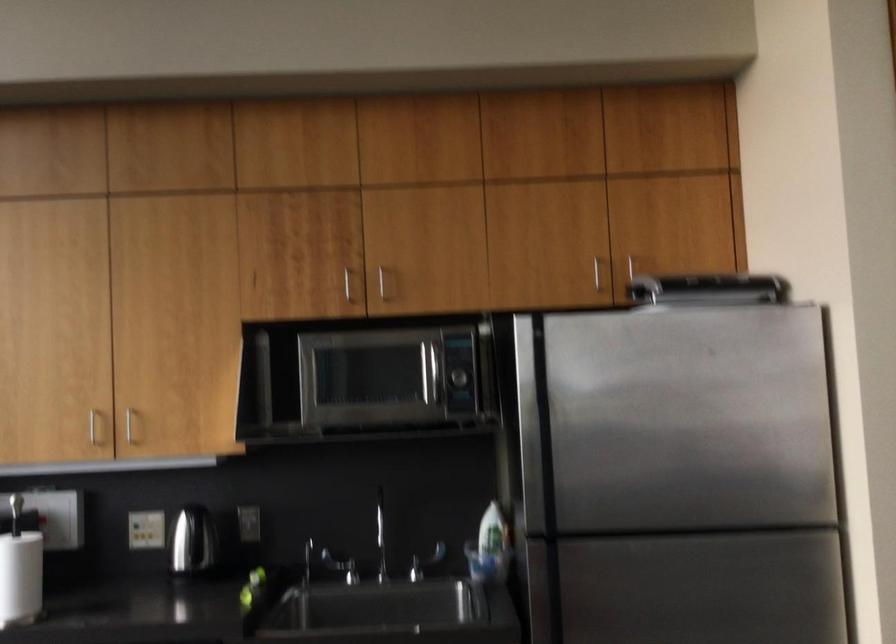
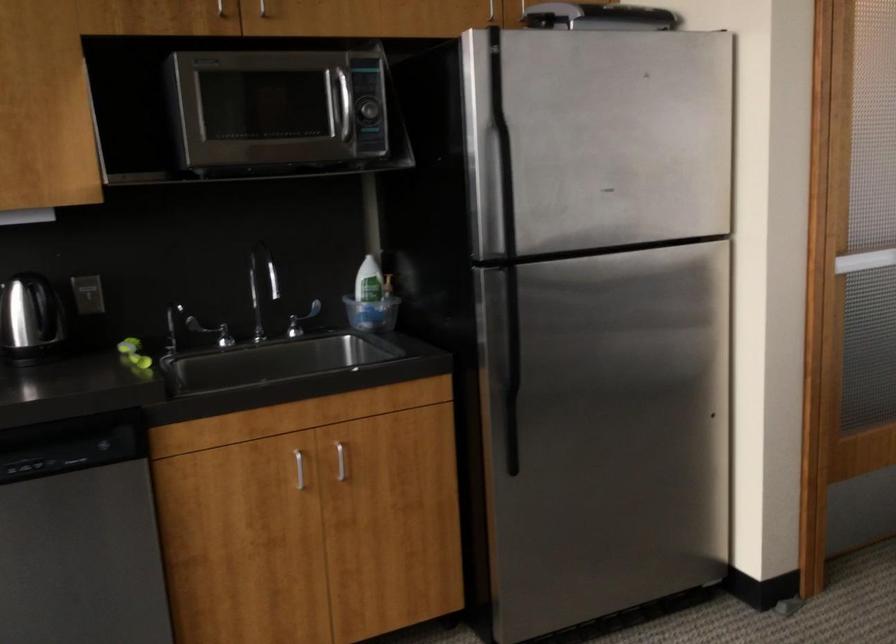
Question: The camera is either moving clockwise (left) or counter-clockwise (right) around the object. The first image is from the beginning of the video and the second image is from the end. Is the camera moving left or right when shooting the video?

Choices:
 (A) Left
 (B) Right

Answer: (A)